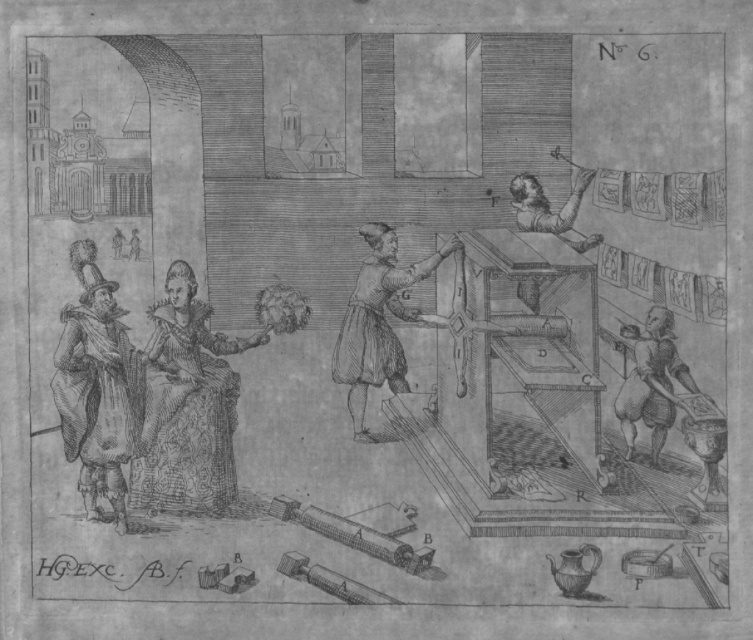
You are an art restorer examining the engraving labeled No. 6. You need to determine the order of objects in the scene from closest to farthest. Which is closer to you between the smooth fabric dress at center and the smooth gray hat at left?

The smooth fabric dress at center is closer to the viewer than the smooth gray hat at left.

In the historical engraving labeled No. 6, there is a smooth fabric dress at center and a smooth gray hat at left. Which object is shorter in height?

The smooth fabric dress at center has a lesser height compared to the smooth gray hat at left, so the smooth fabric dress at center is shorter.

You are an apprentice in the workshop and need to locate the smooth gray hat at left for your master. Based on the coordinates provided, where exactly should you look to find it?

The smooth gray hat at left is located at coordinates point (98, 392).